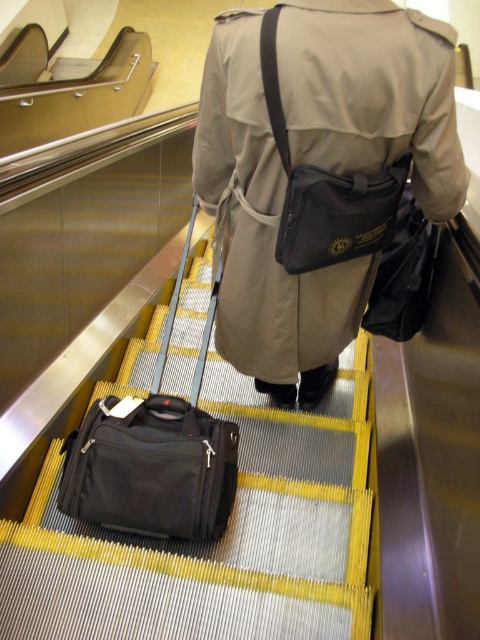
Question: Which object appears closest to the camera in this image?

Choices:
 (A) matte black pouch at center
 (B) black fabric suitcase at center
 (C) matte black bag at center
 (D) black fabric bag at lower left

Answer: (C)

Question: Does black fabric bag at lower left have a greater width compared to matte black pouch at center?

Choices:
 (A) no
 (B) yes

Answer: (B)

Question: Which object appears farthest from the camera in this image?

Choices:
 (A) black fabric suitcase at center
 (B) matte black pouch at center

Answer: (A)

Question: Can you confirm if matte black bag at center is bigger than matte black pouch at center?

Choices:
 (A) yes
 (B) no

Answer: (A)

Question: Can you confirm if matte black bag at center is wider than black fabric bag at lower left?

Choices:
 (A) yes
 (B) no

Answer: (A)

Question: Estimate the real-world distances between objects in this image. Which object is farther from the matte black pouch at center?

Choices:
 (A) black fabric suitcase at center
 (B) matte black bag at center

Answer: (A)